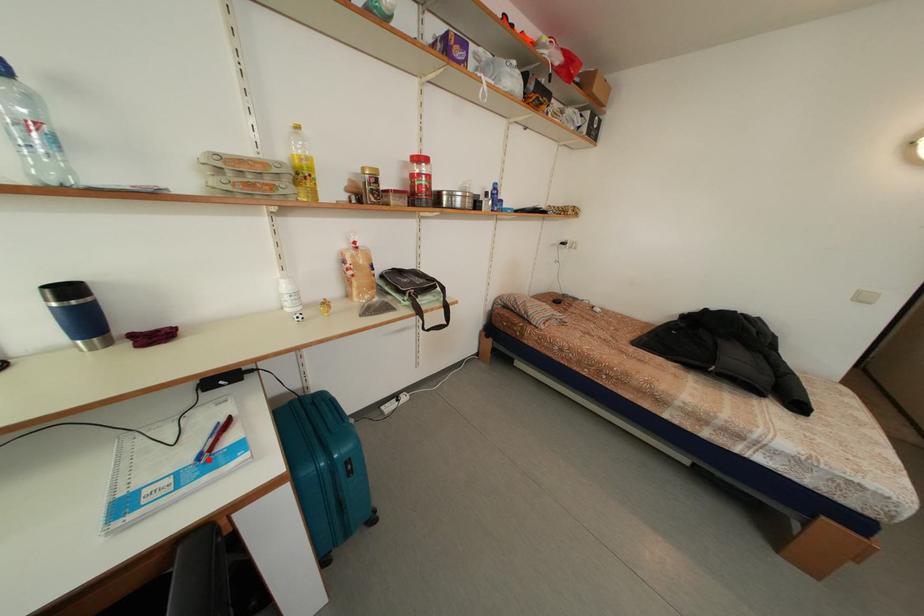
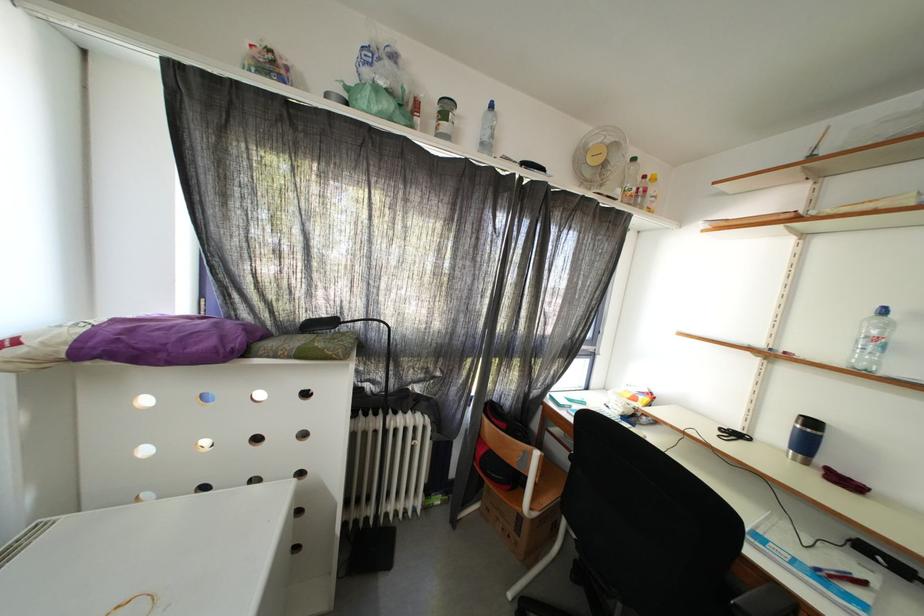
Question: I am providing you with two images of the same scene from different viewpoints. A red point is shown in image1. For the corresponding object point in image2, is it positioned nearer or farther from the camera?

Choices:
 (A) Nearer
 (B) Farther

Answer: (A)